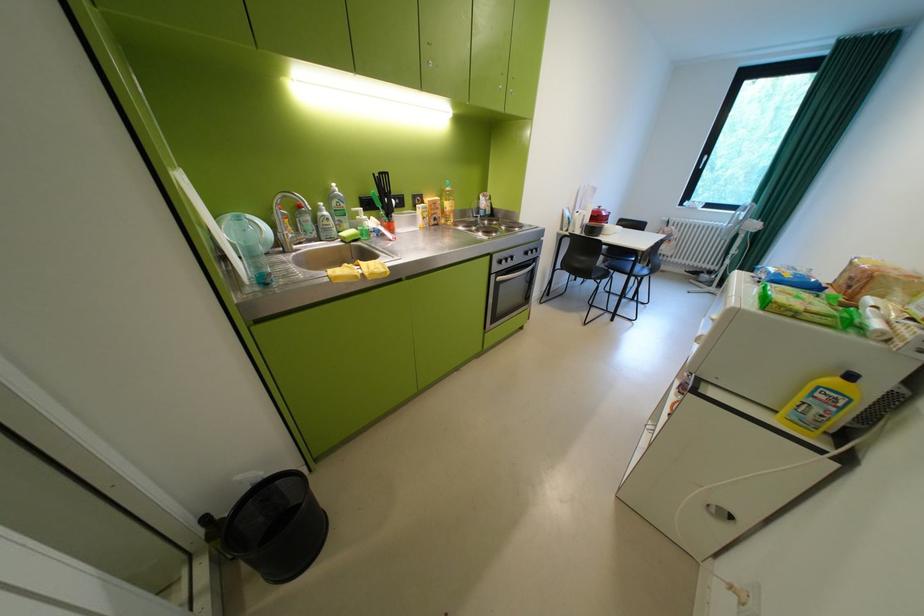
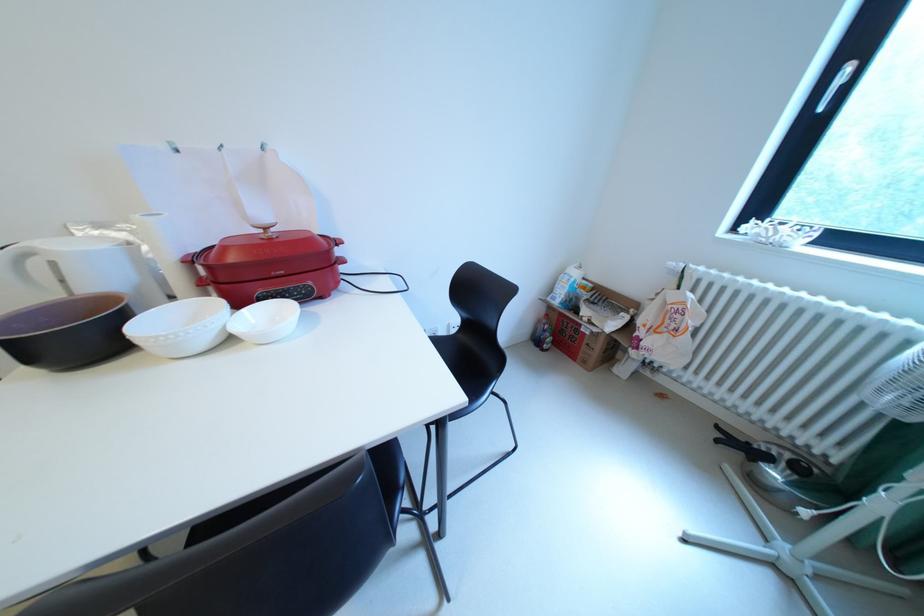
Which direction would the cameraman need to move to produce the second image?

The cameraman walked toward right, forward.